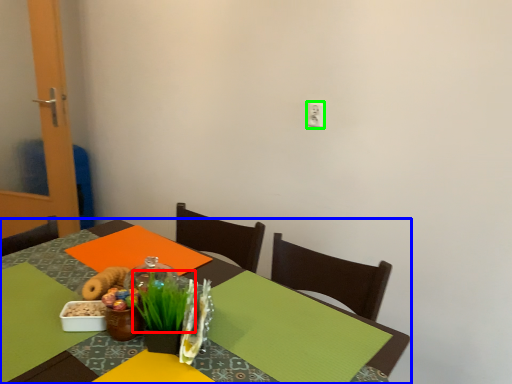
Question: Which object is the farthest from grass (highlighted by a red box)? Choose among these: table (highlighted by a blue box) or electric outlet (highlighted by a green box).

Choices:
 (A) table
 (B) electric outlet

Answer: (B)